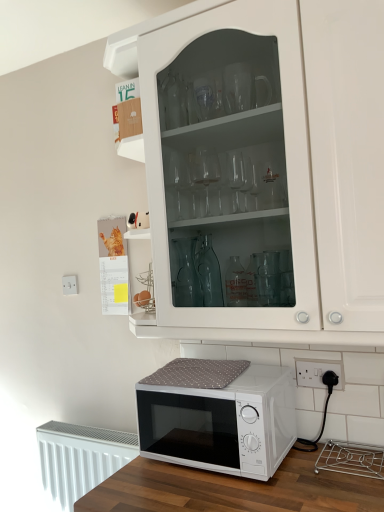
Find the location of a particular element. The height and width of the screenshot is (512, 384). empty space that is ontop of white matte microwave at lower center (from a real-world perspective) is located at coordinates (214, 366).